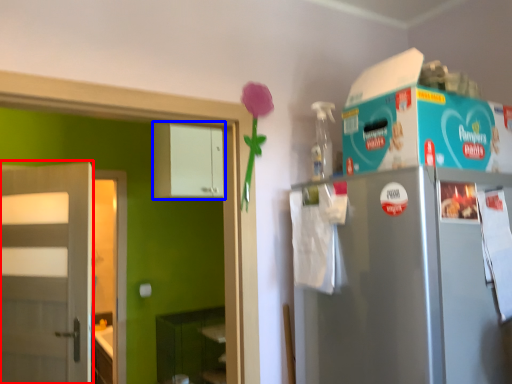
Question: Which of the following is the closest to the observer, door (highlighted by a red box) or cabinetry (highlighted by a blue box)?

Choices:
 (A) door
 (B) cabinetry

Answer: (A)